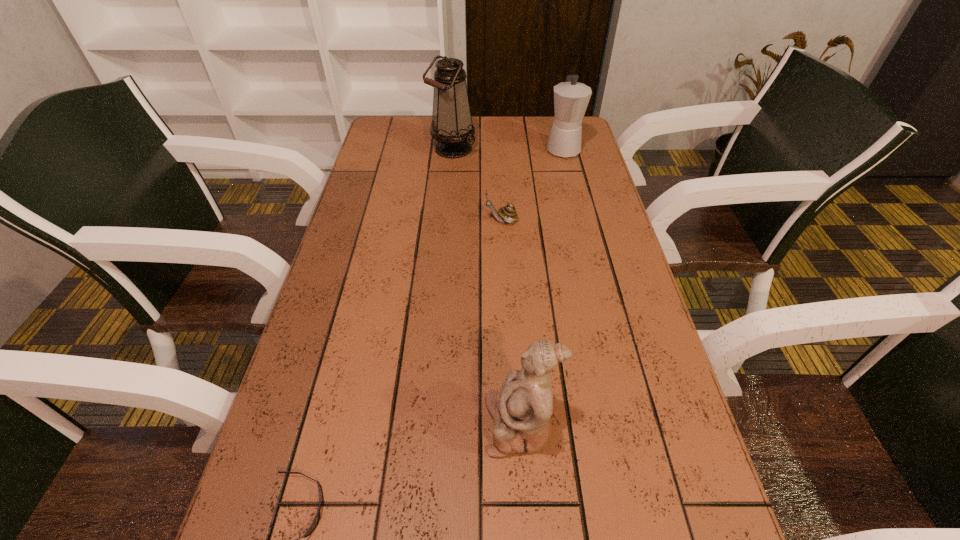
Locate an element on the screen. The height and width of the screenshot is (540, 960). free space located on the front-facing side of the second nearest object is located at coordinates (404, 425).

The height and width of the screenshot is (540, 960). I want to click on free space located on the face of the second shortest object, so click(391, 221).

Identify the location of vacant space located 0.260m on the face of the second shortest object. (391, 221).

Find the location of `free space located on the face of the second shortest object`. free space located on the face of the second shortest object is located at coordinates (459, 221).

Where is `oil lamp located in the far edge section of the desktop`? The width and height of the screenshot is (960, 540). oil lamp located in the far edge section of the desktop is located at coordinates (452, 127).

Find the location of a particular element. The image size is (960, 540). coffeepot located at the far edge is located at coordinates (571, 98).

Locate an element on the screen. object that is at the right edge is located at coordinates (571, 98).

You are a GUI agent. You are given a task and a screenshot of the screen. Output one action in this format:
    pyautogui.click(x=<x>, y=<y>)
    Task: Click on the object at the far right corner
    
    Given the screenshot: What is the action you would take?
    pyautogui.click(x=571, y=98)

The height and width of the screenshot is (540, 960). I want to click on vacant point at the far edge, so click(488, 144).

In the image, there is a desktop. Where is `vacant space at the left edge`? The image size is (960, 540). vacant space at the left edge is located at coordinates (374, 241).